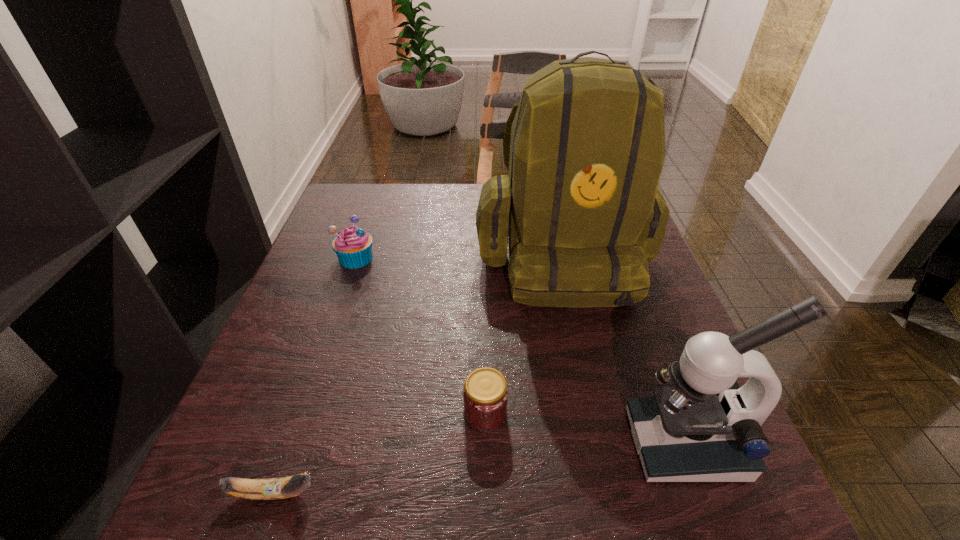
The width and height of the screenshot is (960, 540). In order to click on free area in between the muffin and the tallest object in this screenshot , I will do `click(459, 256)`.

Locate an element on the screen. vacant space that is in between the banana and the jam is located at coordinates (379, 453).

In order to click on free point between the jam and the microscope in this screenshot , I will do `click(586, 428)`.

You are a GUI agent. You are given a task and a screenshot of the screen. Output one action in this format:
    pyautogui.click(x=<x>, y=<y>)
    Task: Click on the vacant region between the muffin and the microscope
    This screenshot has height=540, width=960.
    Given the screenshot: What is the action you would take?
    pyautogui.click(x=520, y=350)

Locate an element on the screen. This screenshot has height=540, width=960. vacant space that's between the banana and the tallest object is located at coordinates (418, 374).

Identify the location of the closest object to the jam. (581, 213).

I want to click on the third closest object to the backpack, so click(353, 245).